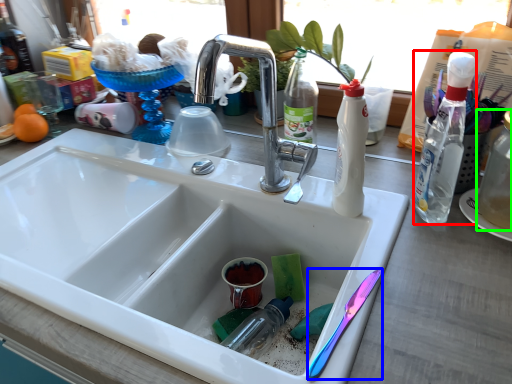
Question: Estimate the real-world distances between objects in this image. Which object is farther from bottle (highlighted by a red box), silverware (highlighted by a blue box) or bottle (highlighted by a green box)?

Choices:
 (A) silverware
 (B) bottle

Answer: (A)